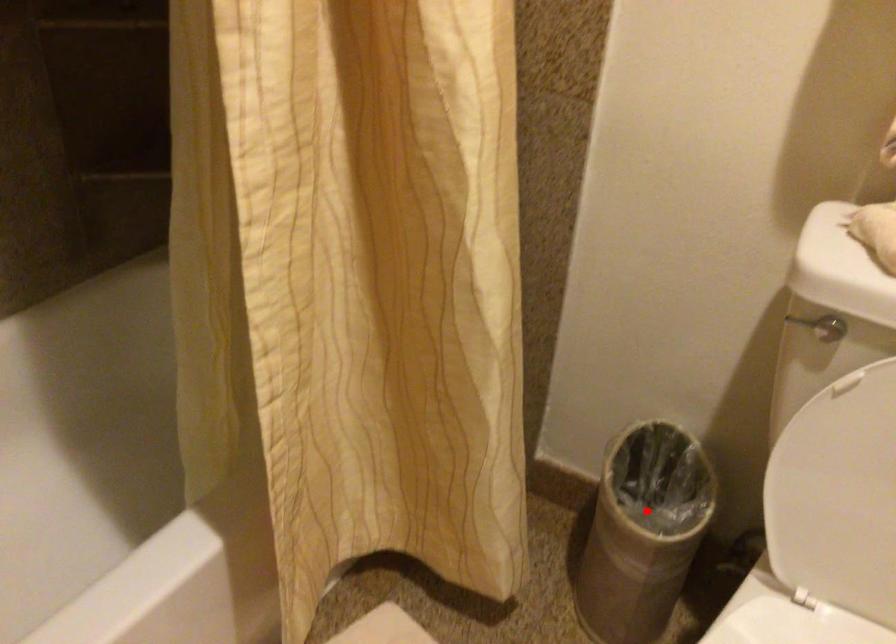
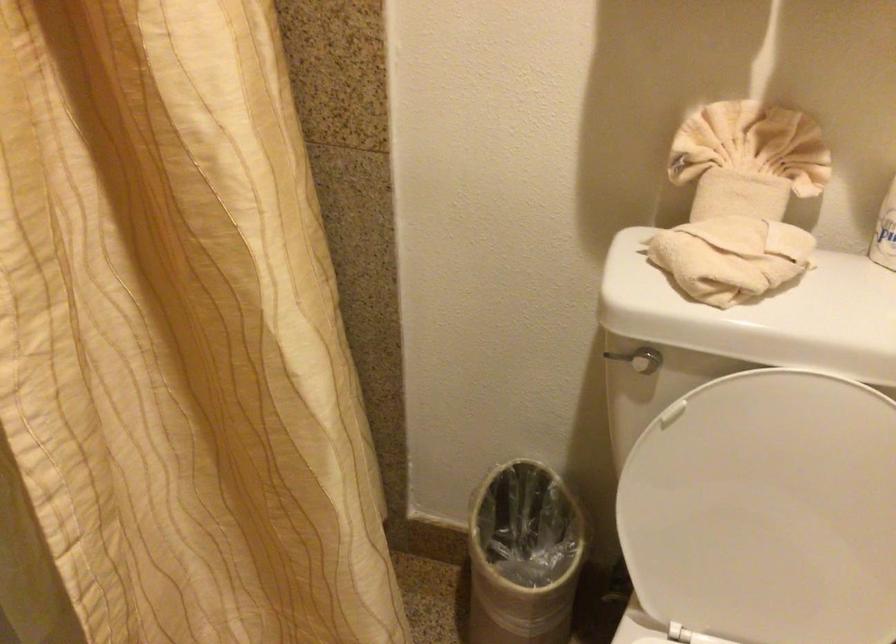
In the second image, find the point that corresponds to the highlighted location in the first image.

(522, 556)